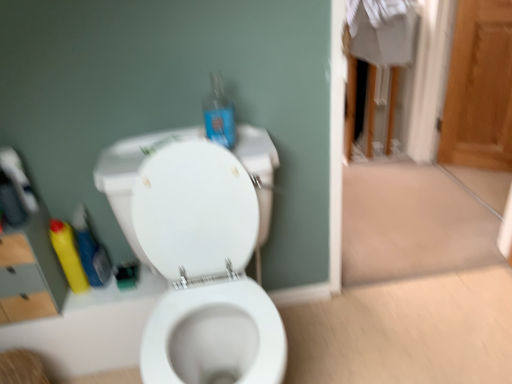
Question: Is translucent blue plastic bottle at upper center with matte gray medicine cabinet at left?

Choices:
 (A) yes
 (B) no

Answer: (B)

Question: Is translucent blue plastic bottle at upper center at the left side of matte gray medicine cabinet at left?

Choices:
 (A) yes
 (B) no

Answer: (B)

Question: Is translucent blue plastic bottle at upper center looking in the opposite direction of matte gray medicine cabinet at left?

Choices:
 (A) yes
 (B) no

Answer: (B)

Question: Is translucent blue plastic bottle at upper center outside matte gray medicine cabinet at left?

Choices:
 (A) yes
 (B) no

Answer: (A)

Question: Considering the relative sizes of translucent blue plastic bottle at upper center and matte gray medicine cabinet at left in the image provided, is translucent blue plastic bottle at upper center taller than matte gray medicine cabinet at left?

Choices:
 (A) yes
 (B) no

Answer: (B)

Question: Is translucent blue plastic bottle at upper center taller or shorter than yellow plastic bottle at left, which appears as the second cleaning product when viewed from the left?

Choices:
 (A) tall
 (B) short

Answer: (B)

Question: From the image's perspective, is translucent blue plastic bottle at upper center positioned above or below yellow plastic bottle at left, the first cleaning product positioned from the right?

Choices:
 (A) above
 (B) below

Answer: (A)

Question: Considering the positions of translucent blue plastic bottle at upper center and yellow plastic bottle at left, the first cleaning product positioned from the right, in the image, is translucent blue plastic bottle at upper center bigger or smaller than yellow plastic bottle at left, the first cleaning product positioned from the right,?

Choices:
 (A) big
 (B) small

Answer: (B)

Question: Is translucent blue plastic bottle at upper center spatially inside yellow plastic bottle at left, the first cleaning product positioned from the right, or outside of it?

Choices:
 (A) outside
 (B) inside

Answer: (A)

Question: Visually, is yellow matte bottle at lower left, the 2th cleaning product positioned from the right, positioned to the left or to the right of matte gray medicine cabinet at left?

Choices:
 (A) right
 (B) left

Answer: (A)

Question: Considering the positions of yellow matte bottle at lower left, which ranks as the first cleaning product in left-to-right order, and matte gray medicine cabinet at left in the image, is yellow matte bottle at lower left, which ranks as the first cleaning product in left-to-right order, bigger or smaller than matte gray medicine cabinet at left?

Choices:
 (A) big
 (B) small

Answer: (B)

Question: Is point (79, 276) positioned closer to the camera than point (55, 294)?

Choices:
 (A) farther
 (B) closer

Answer: (A)

Question: Would you say yellow matte bottle at lower left, which ranks as the first cleaning product in left-to-right order, is inside or outside matte gray medicine cabinet at left?

Choices:
 (A) outside
 (B) inside

Answer: (A)

Question: From the image's perspective, is yellow matte bottle at lower left, the 2th cleaning product positioned from the right, above or below white glossy toilet at center?

Choices:
 (A) below
 (B) above

Answer: (B)

Question: Is yellow matte bottle at lower left, the 2th cleaning product positioned from the right, wider or thinner than white glossy toilet at center?

Choices:
 (A) thin
 (B) wide

Answer: (A)